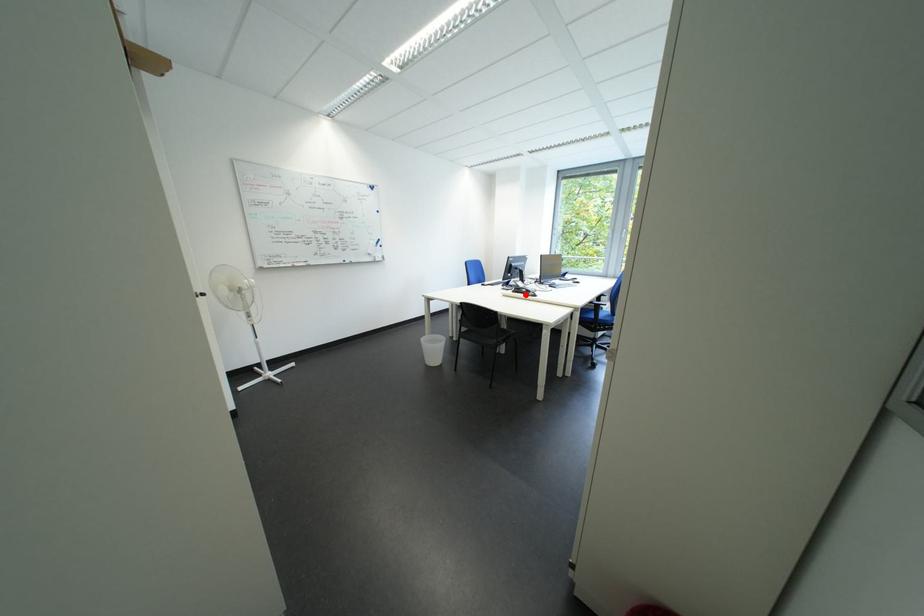
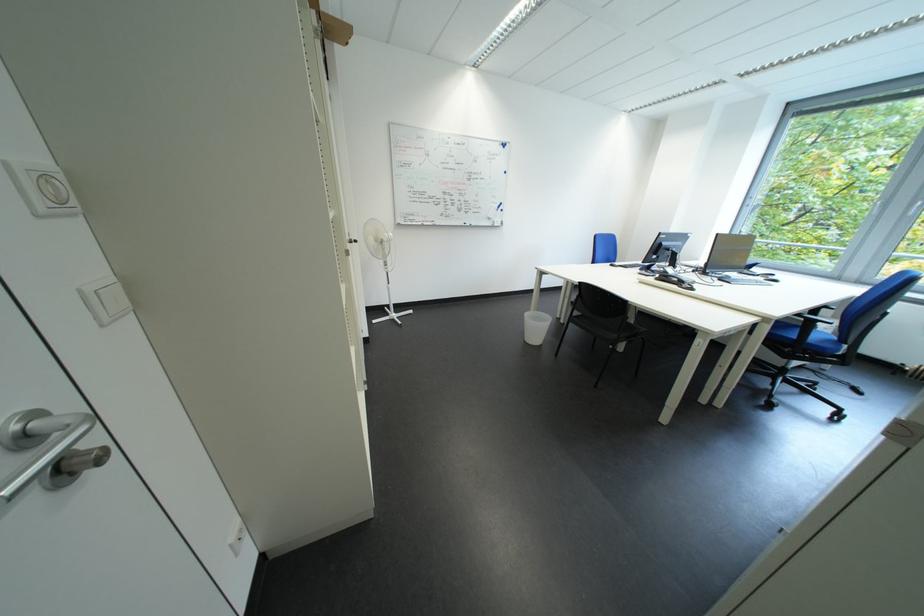
The point at the highlighted location is marked in the first image. Where is the corresponding point in the second image?

(669, 282)